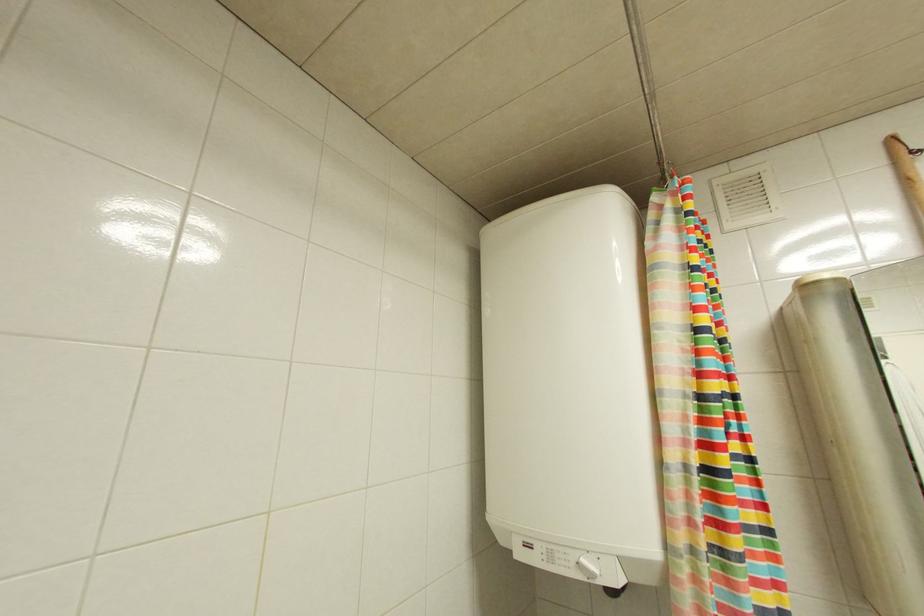
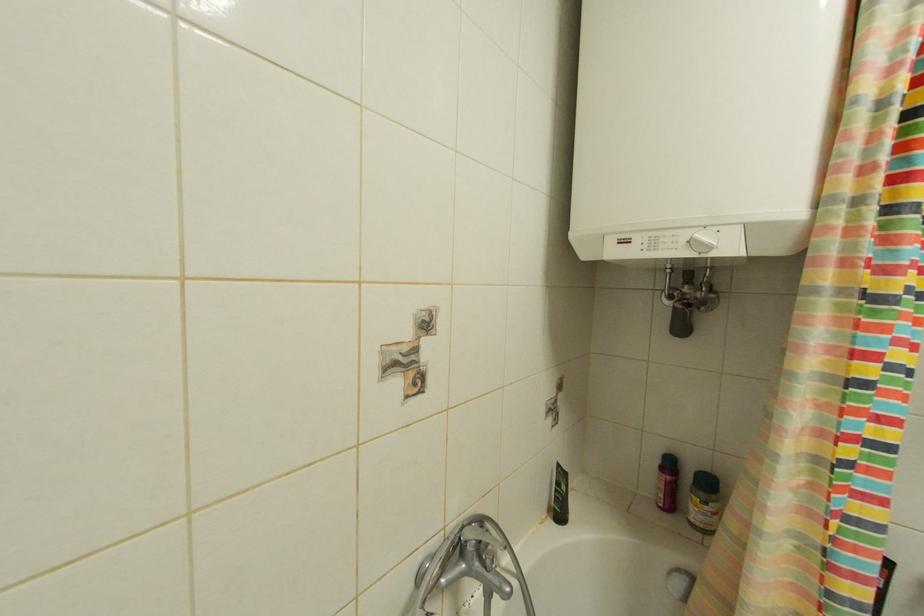
Question: The images are taken continuously from a first-person perspective. In which direction is your viewpoint rotating?

Choices:
 (A) Left
 (B) Right
 (C) Up
 (D) Down

Answer: (D)